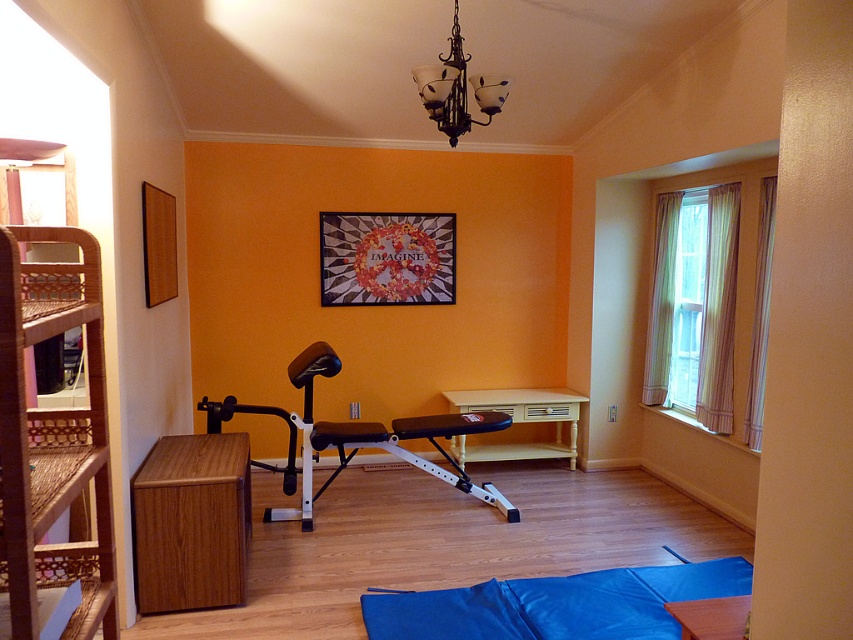
Does woven wood bunk bed at left appear on the right side of bronze glass chandelier at upper center?

No, woven wood bunk bed at left is not to the right of bronze glass chandelier at upper center.

Measure the distance between point (6,476) and camera.

1.37 meters

Does point (93, 456) come behind point (454, 17)?

No, (93, 456) is in front of (454, 17).

In order to click on woven wood bunk bed at left in this screenshot , I will do `click(51, 438)`.

Does brown leather bunk bed at center have a larger size compared to bronze glass chandelier at upper center?

Indeed, brown leather bunk bed at center has a larger size compared to bronze glass chandelier at upper center.

Which is behind, point (202, 401) or point (444, 83)?

Positioned behind is point (202, 401).

Is point (425, 417) more distant than point (428, 81)?

Yes, it is.

At what (x,y) coordinates should I click in order to perform the action: click on brown leather bunk bed at center. Please return your answer as a coordinate pair (x, y). This screenshot has width=853, height=640. Looking at the image, I should click on (376, 440).

Which is more to the right, wooden cabinet at left or bronze glass chandelier at upper center?

bronze glass chandelier at upper center is more to the right.

Measure the distance between point (x=239, y=468) and camera.

Point (x=239, y=468) is 3.18 meters from camera.

In order to click on wooden cabinet at left in this screenshot , I will do `click(190, 522)`.